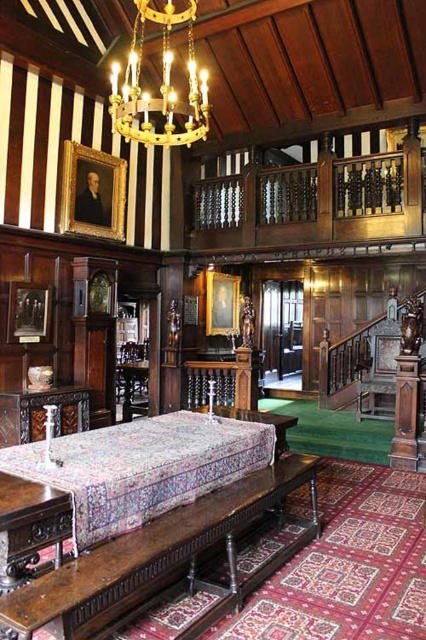
Who is lower down, polished dark wood table at center or gold metallic chandelier at upper center?

polished dark wood table at center

Based on the photo, between polished dark wood table at center and gold metallic chandelier at upper center, which one appears on the left side from the viewer's perspective?

gold metallic chandelier at upper center is more to the left.

Is point (52, 596) positioned in front of point (117, 96)?

Yes.

Where is `polished dark wood table at center`? polished dark wood table at center is located at coordinates (164, 560).